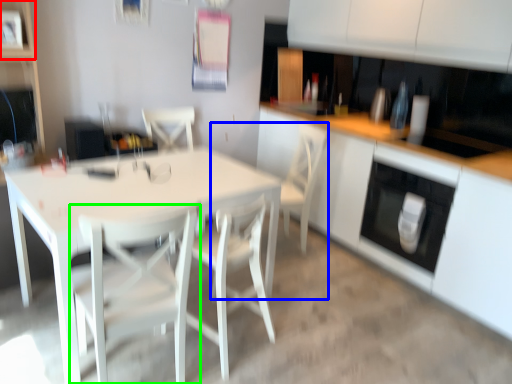
Question: Based on their relative distances, which object is nearer to shelf (highlighted by a red box)? Choose from armchair (highlighted by a blue box) and chair (highlighted by a green box).

Choices:
 (A) armchair
 (B) chair

Answer: (B)